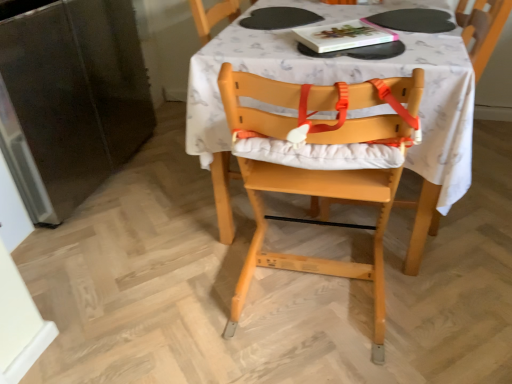
Where is `vacant space situated on the left part of white fabric table at center`? vacant space situated on the left part of white fabric table at center is located at coordinates (141, 220).